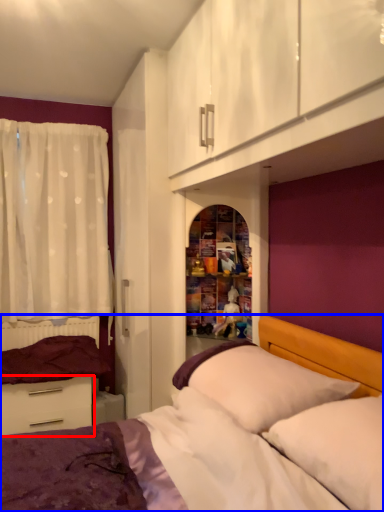
Question: Which object is further to the camera taking this photo, drawer (highlighted by a red box) or bed (highlighted by a blue box)?

Choices:
 (A) drawer
 (B) bed

Answer: (A)